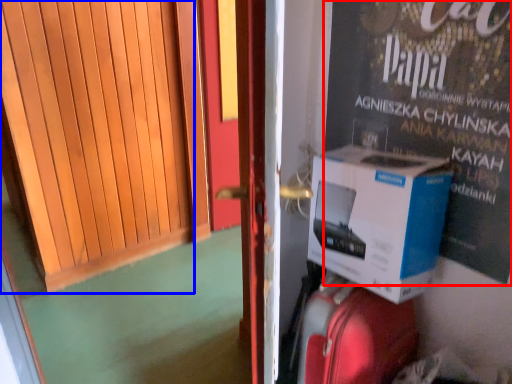
Question: Which of the following is the farthest to the observer, advertisement (highlighted by a red box) or door (highlighted by a blue box)?

Choices:
 (A) advertisement
 (B) door

Answer: (A)